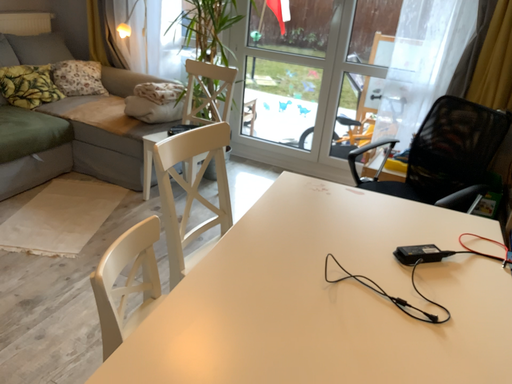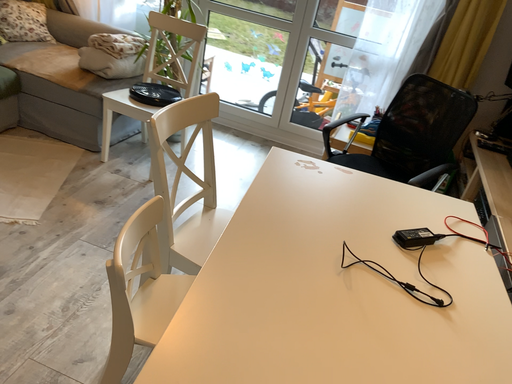
Question: Which way did the camera rotate in the video?

Choices:
 (A) rotated right
 (B) rotated left

Answer: (A)